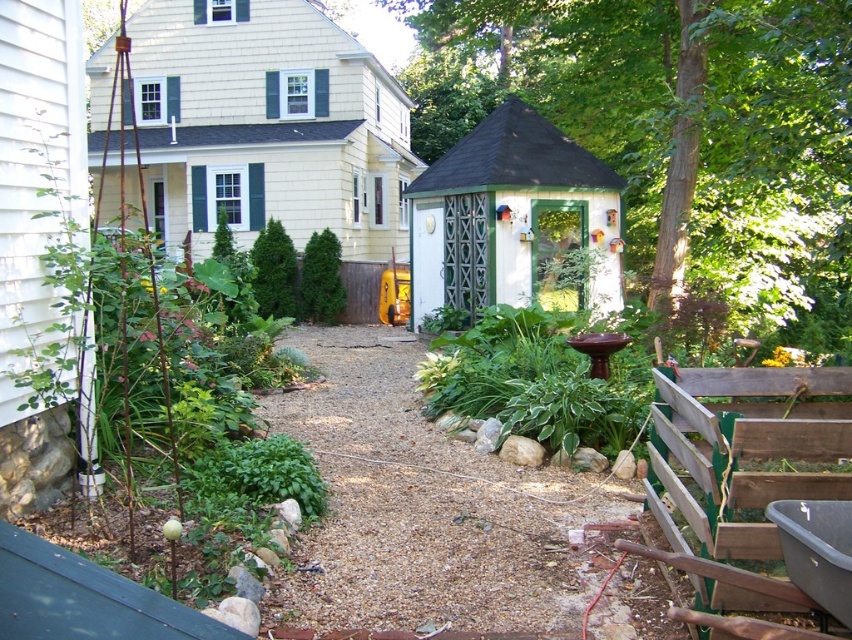
Does brown gravel path at center have a smaller size compared to green leafy shrub at center?

Actually, brown gravel path at center might be larger than green leafy shrub at center.

Based on the photo, can you confirm if brown gravel path at center is positioned below green leafy shrub at center?

Correct, brown gravel path at center is located below green leafy shrub at center.

Measure the distance between point (321,577) and camera.

They are 4.67 meters apart.

You are a GUI agent. You are given a task and a screenshot of the screen. Output one action in this format:
    pyautogui.click(x=<x>, y=<y>)
    Task: Click on the brown gravel path at center
    The image size is (852, 640).
    Given the screenshot: What is the action you would take?
    pyautogui.click(x=419, y=509)

Is white painted wood gazebo at center positioned at the back of green leafy shrub at center?

No, it is not.

Is white painted wood gazebo at center bigger than green leafy shrub at center?

Incorrect, white painted wood gazebo at center is not larger than green leafy shrub at center.

Where is `white painted wood gazebo at center`? This screenshot has height=640, width=852. white painted wood gazebo at center is located at coordinates (515, 221).

Identify the location of white painted wood gazebo at center. The width and height of the screenshot is (852, 640). (515, 221).

What do you see at coordinates (419, 509) in the screenshot? The width and height of the screenshot is (852, 640). I see `brown gravel path at center` at bounding box center [419, 509].

Can you confirm if brown gravel path at center is positioned above white painted wood gazebo at center?

No, brown gravel path at center is not above white painted wood gazebo at center.

You are a GUI agent. You are given a task and a screenshot of the screen. Output one action in this format:
    pyautogui.click(x=<x>, y=<y>)
    Task: Click on the brown gravel path at center
    The image size is (852, 640).
    Given the screenshot: What is the action you would take?
    pyautogui.click(x=419, y=509)

At what (x,y) coordinates should I click in order to perform the action: click on brown gravel path at center. Please return your answer as a coordinate pair (x, y). Image resolution: width=852 pixels, height=640 pixels. Looking at the image, I should click on (419, 509).